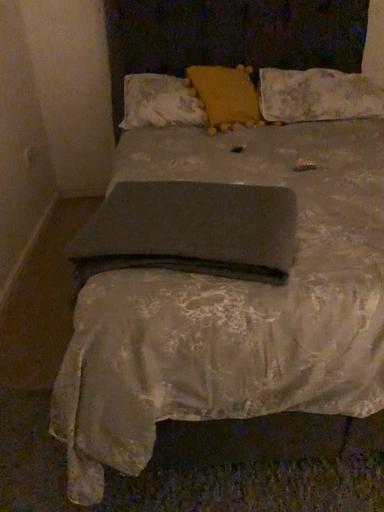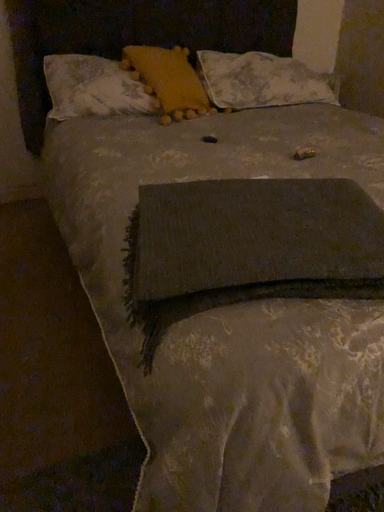
Question: Which way did the camera rotate in the video?

Choices:
 (A) rotated left
 (B) rotated right

Answer: (B)